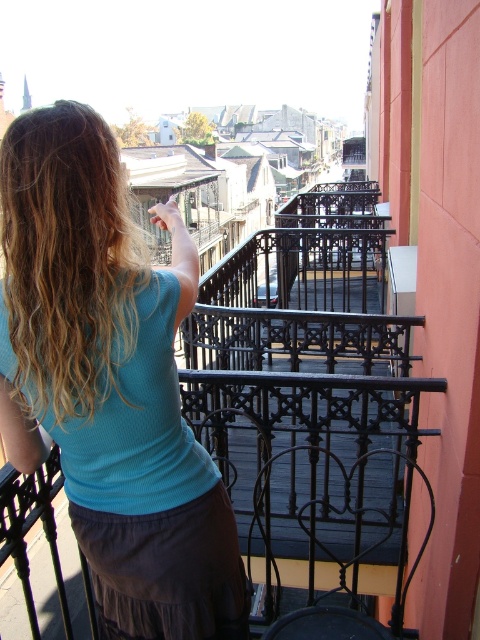
Does teal ribbed tank top at upper left have a greater width compared to blonde wavy hair at upper left?

Yes.

Can you confirm if teal ribbed tank top at upper left is shorter than blonde wavy hair at upper left?

Answer: No, teal ribbed tank top at upper left is not shorter than blonde wavy hair at upper left.

The image size is (480, 640). I want to click on teal ribbed tank top at upper left, so click(109, 381).